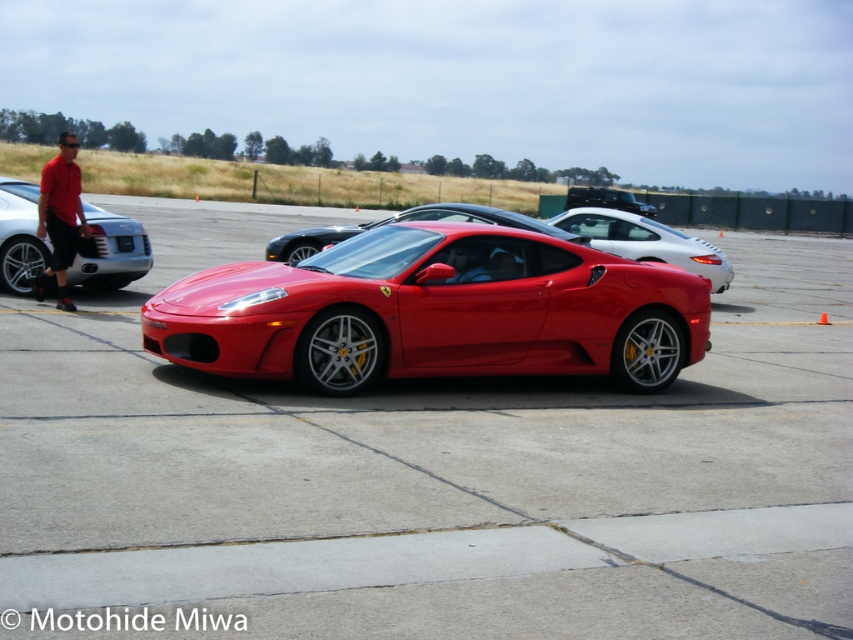
You are standing at the point marked as point (428, 474) in the image. What material are you standing on?

The material at point (428, 474) is glossy asphalt tarmac at center.

You are a photographer trying to capture both the shiny red ferrari at center and the glossy carbon fiber sports car at center in a single frame. Since you want to emphasize their sizes, which car should you position closer to the camera to make it appear larger?

To emphasize their sizes, you should position the shiny red ferrari at center closer to the camera because it is shorter than the glossy carbon fiber sports car at center. This way, the shorter car can be placed nearer to appear larger in the photo.

You are standing in front of the red Ferrari sports car and want to know which of the two points, point [659,304] or point [676,262], is closer to you. Can you determine which one?

Point [659,304] is closer to the camera than point [676,262], so it is the closer one to you.